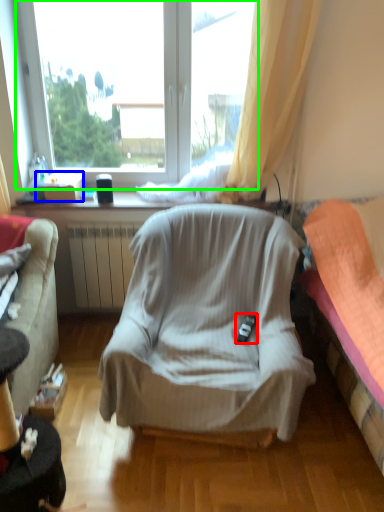
Question: Which is farther away from remote control (highlighted by a red box)? box (highlighted by a blue box) or window (highlighted by a green box)?

Choices:
 (A) box
 (B) window

Answer: (B)